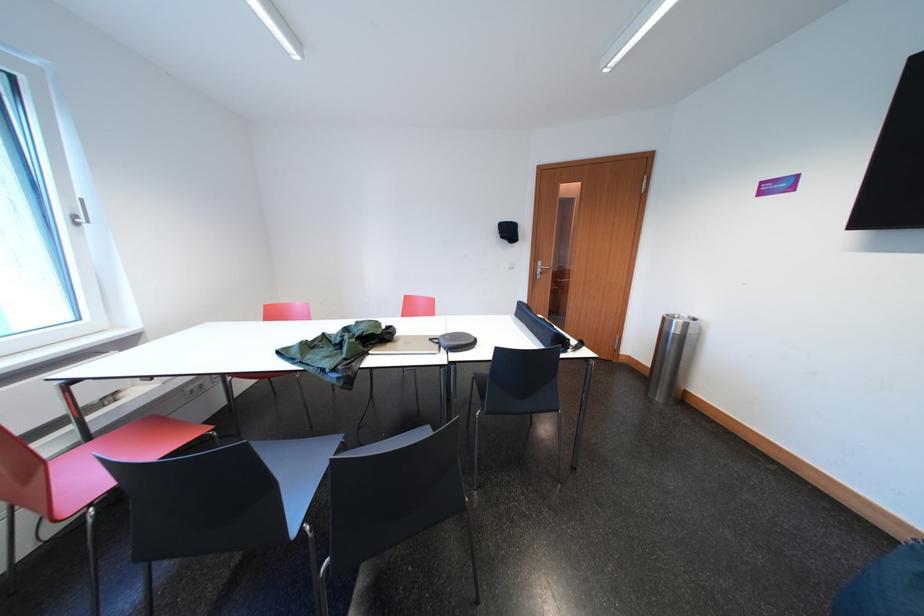
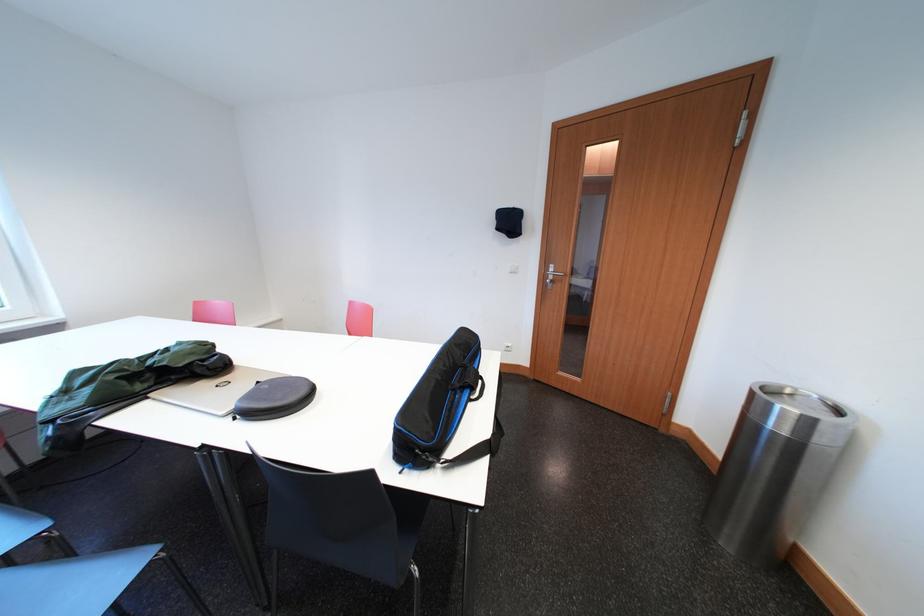
The point at (441, 344) is marked in the first image. Where is the corresponding point in the second image?

(268, 387)